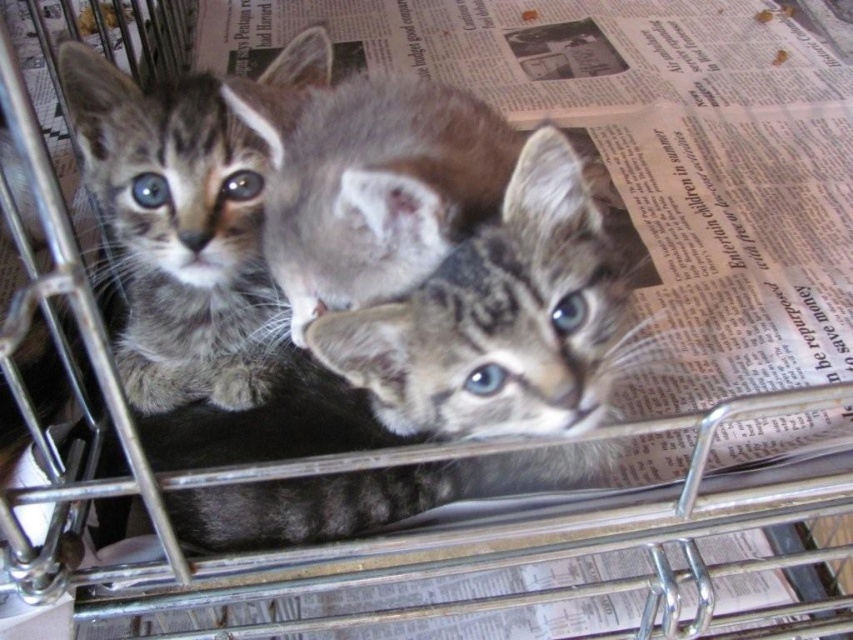
You are a veterinarian examining the kittens in the cage. You need to check the gray tabby kitten at left and the gray fur kitten at center. Which kitten is located below the other?

The gray tabby kitten at left is positioned under the gray fur kitten at center, so the gray tabby kitten at left is below the gray fur kitten at center.

You are a veterinarian examining the kittens in the cage. You need to check the gray tabby kitten at left and the gray fur kitten at center. Based on their positions, which kitten is closer to the left side of the cage?

The gray tabby kitten at left is closer to the left side of the cage since it is positioned to the left of the gray fur kitten at center.